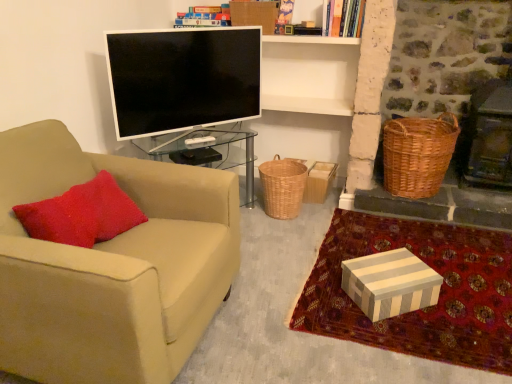
At what (x,y) coordinates should I click in order to perform the action: click on vacant area that lies between woven brown basket at center and white striped fabric at lower right. Please return your answer as a coordinate pair (x, y). The height and width of the screenshot is (384, 512). Looking at the image, I should click on coord(284,242).